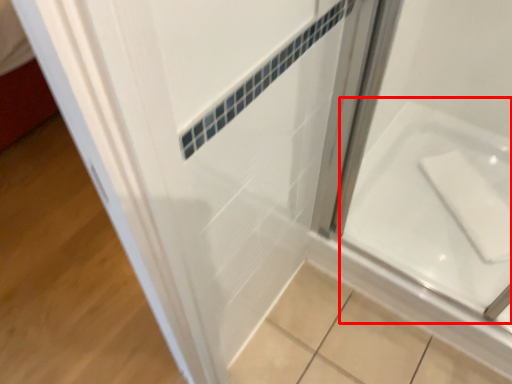
Question: From the image, what is the correct spatial relationship of bath (annotated by the red box) in relation to door?

Choices:
 (A) right
 (B) left

Answer: (A)